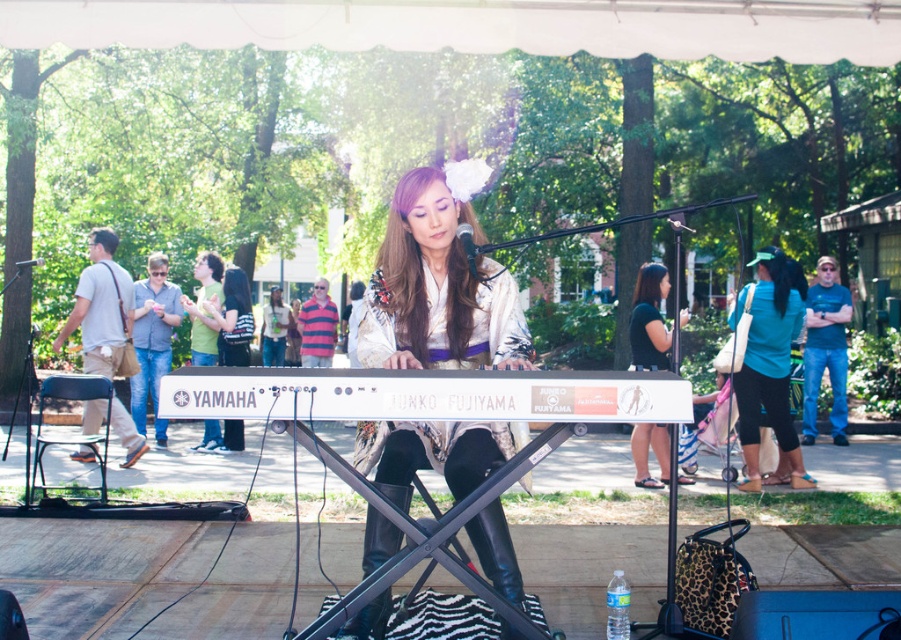
You are a stagehand who needs to adjust the microphone stand between the white matte keyboard at center and the black fabric shirt at center. The microphone stand requires at least 15 feet of space between the keyboard and the performer to function properly. Is the current distance sufficient?

The white matte keyboard at center and black fabric shirt at center are 16.36 feet apart from each other. Since the required space is 15 feet, the current distance of 16.36 feet is sufficient for the microphone stand to function properly.

You are a photographer at the event and want to capture a clear shot of the white matte keyboard at center without the denim jacket at center blocking it. Is this possible based on their positions?

The white matte keyboard at center is in front of the denim jacket at center, so it is already positioned in a way that the keyboard is not blocked by the jacket. Therefore, you can capture a clear shot of the white matte keyboard at center without obstruction from the denim jacket at center.